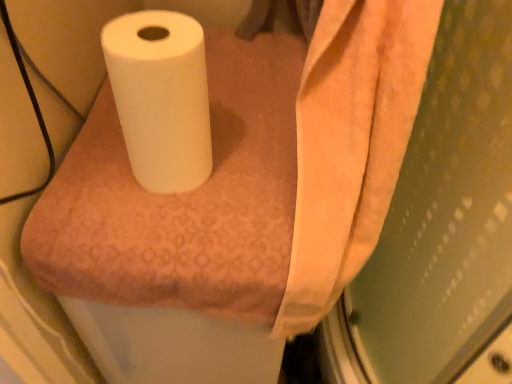
At what (x,y) coordinates should I click in order to perform the action: click on vacant space in front of white matte toilet paper at center. Please return your answer as a coordinate pair (x, y). This screenshot has width=512, height=384. Looking at the image, I should click on (167, 219).